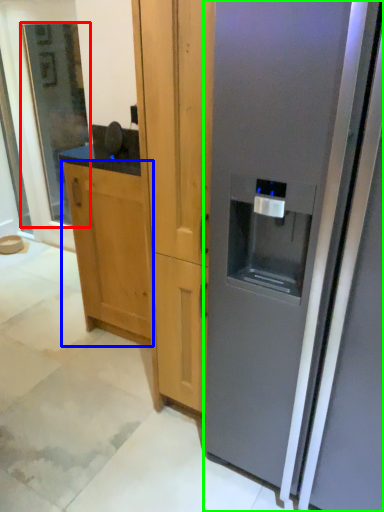
Question: Based on their relative distances, which object is farther from glass door (highlighted by a red box)? Choose from cabinetry (highlighted by a blue box) and refrigerator (highlighted by a green box).

Choices:
 (A) cabinetry
 (B) refrigerator

Answer: (B)